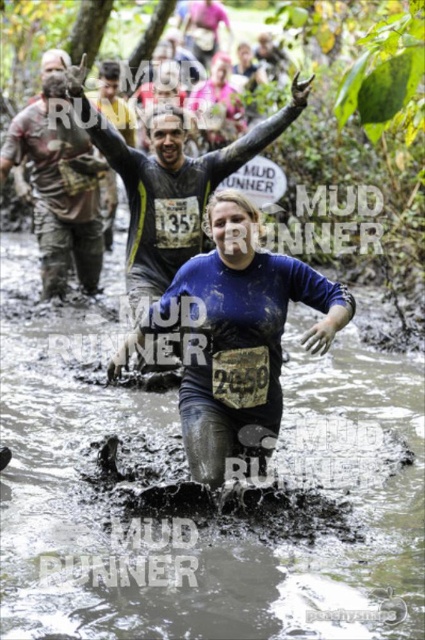
Between blue cotton shirt at center and blue fabric shirt at center, which one appears on the left side from the viewer's perspective?

From the viewer's perspective, blue cotton shirt at center appears more on the left side.

Is blue cotton shirt at center below blue fabric shirt at center?

Indeed, blue cotton shirt at center is positioned under blue fabric shirt at center.

Image resolution: width=425 pixels, height=640 pixels. Identify the location of blue cotton shirt at center. (240, 337).

Where is `blue cotton shirt at center`? Image resolution: width=425 pixels, height=640 pixels. blue cotton shirt at center is located at coordinates (240, 337).

Locate an element on the screen. blue fabric shirt at center is located at coordinates (170, 182).

Is point (269, 140) farther from camera compared to point (59, 266)?

No, it is in front of (59, 266).

Does point (187, 209) lie behind point (90, 168)?

That is False.

Find the location of a particular element. The height and width of the screenshot is (640, 425). blue fabric shirt at center is located at coordinates 170,182.

Who is higher up, muddy water at center or dirty mud face at left?

dirty mud face at left is higher up.

Which is in front, point (96, 508) or point (67, 116)?

Point (96, 508)

This screenshot has width=425, height=640. What do you see at coordinates (183, 476) in the screenshot? I see `muddy water at center` at bounding box center [183, 476].

Image resolution: width=425 pixels, height=640 pixels. I want to click on muddy water at center, so click(x=183, y=476).